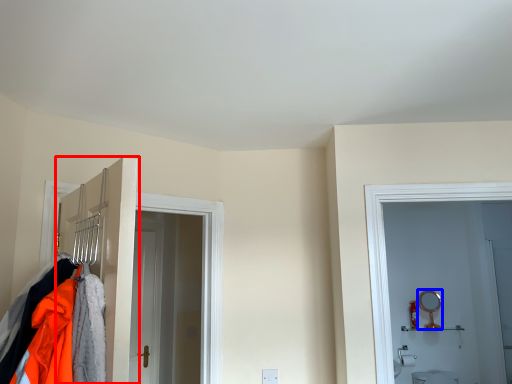
Question: Which object appears farthest to the camera in this image, door (highlighted by a red box) or mirror (highlighted by a blue box)?

Choices:
 (A) door
 (B) mirror

Answer: (B)